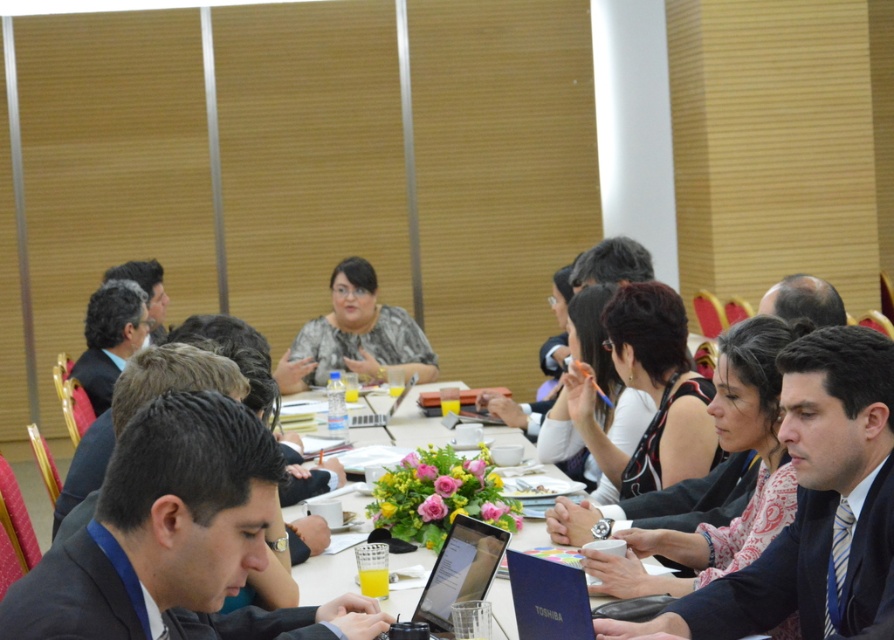
Question: Can you confirm if silver metallic laptop at center is positioned to the left of metallic silver laptop at center?

Choices:
 (A) no
 (B) yes

Answer: (A)

Question: Is dark blue suit at center positioned before silver metallic laptop at center?

Choices:
 (A) yes
 (B) no

Answer: (A)

Question: Which object is closer to the camera taking this photo?

Choices:
 (A) dark gray suit at center
 (B) dark blue suit at center

Answer: (A)

Question: In this image, where is dark gray suit at center located relative to bald head at center?

Choices:
 (A) left
 (B) right

Answer: (A)

Question: Which point is closer to the camera?

Choices:
 (A) (783, 284)
 (B) (197, 465)

Answer: (B)

Question: Which object appears farthest from the camera in this image?

Choices:
 (A) dark gray suit at center
 (B) blue matte laptop at lower center
 (C) matte gray blouse at center
 (D) metallic silver laptop at center

Answer: (C)